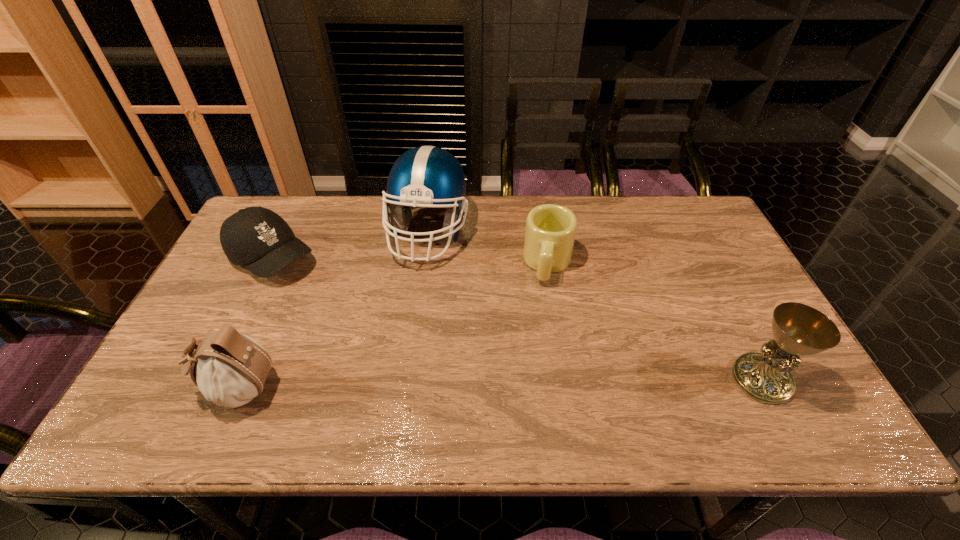
Where is `pouch`? Image resolution: width=960 pixels, height=540 pixels. pouch is located at coordinates (230, 369).

Where is `the rightmost object`? This screenshot has height=540, width=960. the rightmost object is located at coordinates (798, 329).

Locate an element on the screen. the second object from right to left is located at coordinates (550, 232).

Locate an element on the screen. This screenshot has width=960, height=540. baseball cap is located at coordinates (255, 237).

Locate an element on the screen. the tallest object is located at coordinates (427, 176).

In order to click on the third object from left to right in this screenshot , I will do `click(427, 176)`.

At what (x,y) coordinates should I click in order to perform the action: click on blank space located 0.050m on the front-facing side of the pouch. Please return your answer as a coordinate pair (x, y). Image resolution: width=960 pixels, height=540 pixels. Looking at the image, I should click on (176, 388).

Where is `vacant space located 0.390m on the back of the rightmost object`? vacant space located 0.390m on the back of the rightmost object is located at coordinates (694, 251).

The height and width of the screenshot is (540, 960). In order to click on vacant space located 0.340m with the handle on the side of the fourth object from left to right in this screenshot , I will do `click(529, 393)`.

Image resolution: width=960 pixels, height=540 pixels. What are the coordinates of `vacant area situated 0.150m with the handle on the side of the fourth object from left to right` in the screenshot? It's located at (540, 329).